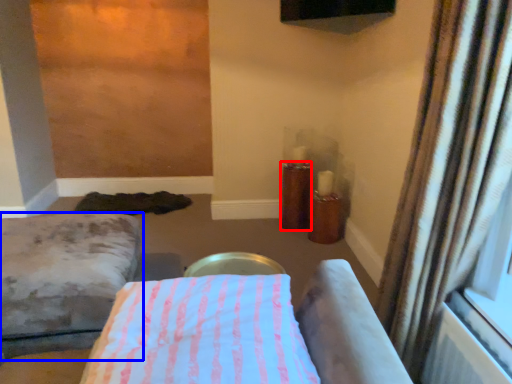
Question: Which point is further to the camera, candle holder (highlighted by a red box) or furniture (highlighted by a blue box)?

Choices:
 (A) candle holder
 (B) furniture

Answer: (A)